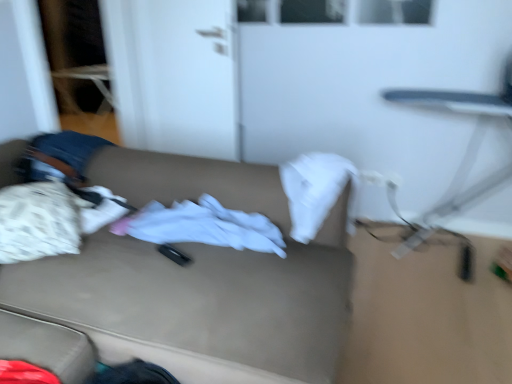
Question: From the image's perspective, is beige fabric couch at center located above white soft cloth at center?

Choices:
 (A) yes
 (B) no

Answer: (B)

Question: Is white soft cloth at center inside beige fabric couch at center?

Choices:
 (A) yes
 (B) no

Answer: (A)

Question: Can you confirm if beige fabric couch at center is smaller than white soft cloth at center?

Choices:
 (A) no
 (B) yes

Answer: (A)

Question: Does beige fabric couch at center have a greater width compared to white soft cloth at center?

Choices:
 (A) yes
 (B) no

Answer: (A)

Question: Would you say beige fabric couch at center is a long distance from white soft cloth at center?

Choices:
 (A) no
 (B) yes

Answer: (A)

Question: Is point (150, 72) positioned closer to the camera than point (215, 215)?

Choices:
 (A) closer
 (B) farther

Answer: (B)

Question: In terms of size, does white matte door at upper left appear bigger or smaller than white soft cloth at center?

Choices:
 (A) big
 (B) small

Answer: (A)

Question: Considering the relative positions of white matte door at upper left and white soft cloth at center in the image provided, is white matte door at upper left to the left or to the right of white soft cloth at center?

Choices:
 (A) left
 (B) right

Answer: (A)

Question: From their relative heights in the image, would you say white matte door at upper left is taller or shorter than white soft cloth at center?

Choices:
 (A) short
 (B) tall

Answer: (B)

Question: Considering the positions of point (218, 49) and point (448, 208), is point (218, 49) closer or farther from the camera than point (448, 208)?

Choices:
 (A) closer
 (B) farther

Answer: (A)

Question: Relative to metallic silver swivel chair at right, is white matte door at upper left in front or behind?

Choices:
 (A) behind
 (B) front

Answer: (A)

Question: Based on their positions, is white matte door at upper left located to the left or right of metallic silver swivel chair at right?

Choices:
 (A) left
 (B) right

Answer: (A)

Question: Considering the positions of white matte door at upper left and metallic silver swivel chair at right in the image, is white matte door at upper left bigger or smaller than metallic silver swivel chair at right?

Choices:
 (A) small
 (B) big

Answer: (A)

Question: Considering the positions of white soft cloth at center and beige fabric couch at center in the image, is white soft cloth at center wider or thinner than beige fabric couch at center?

Choices:
 (A) thin
 (B) wide

Answer: (A)

Question: From the image's perspective, is white soft cloth at center above or below beige fabric couch at center?

Choices:
 (A) below
 (B) above

Answer: (B)